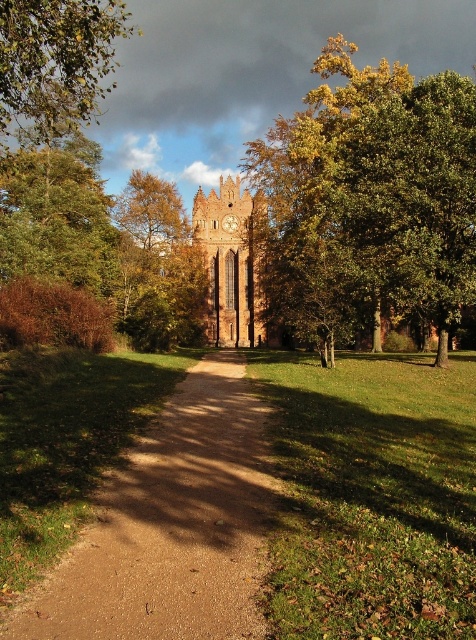
Question: Which point is farther from the camera taking this photo?

Choices:
 (A) (259, 224)
 (B) (390, 291)

Answer: (A)

Question: Based on their relative distances, which object is nearer to the green leafy tree at upper left?

Choices:
 (A) brown gravel path at center
 (B) green leafy tree at upper right
 (C) brown stone church at center

Answer: (C)

Question: Is brown stone church at center further to the viewer compared to yellow-green leaves at upper center?

Choices:
 (A) no
 (B) yes

Answer: (A)

Question: Is green leafy tree at upper left in front of wooden clock at center?

Choices:
 (A) no
 (B) yes

Answer: (B)

Question: Estimate the real-world distances between objects in this image. Which object is farther from the green leafy tree at upper right?

Choices:
 (A) green leafy tree at upper left
 (B) brown stone church at center
 (C) brown gravel path at center
 (D) wooden clock at center

Answer: (A)

Question: Can you confirm if green leafy tree at upper left is wider than wooden clock at center?

Choices:
 (A) no
 (B) yes

Answer: (B)